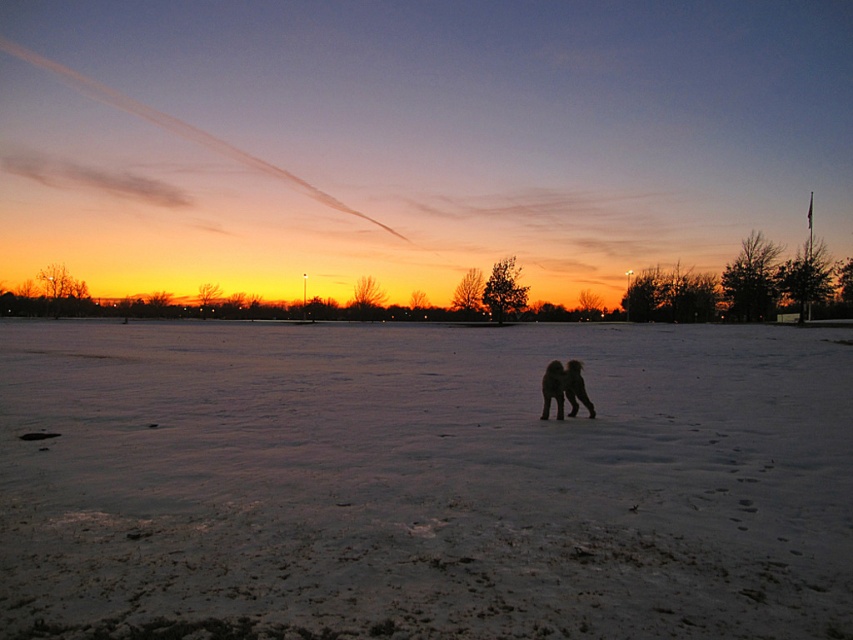
Can you confirm if white powdery snow at center is positioned to the left of black fur dog at center?

Correct, you'll find white powdery snow at center to the left of black fur dog at center.

Is white powdery snow at center smaller than black fur dog at center?

No, white powdery snow at center is not smaller than black fur dog at center.

Who is more distant from viewer, (x=328, y=433) or (x=548, y=400)?

The point (x=548, y=400) is behind.

The height and width of the screenshot is (640, 853). I want to click on white powdery snow at center, so click(x=422, y=483).